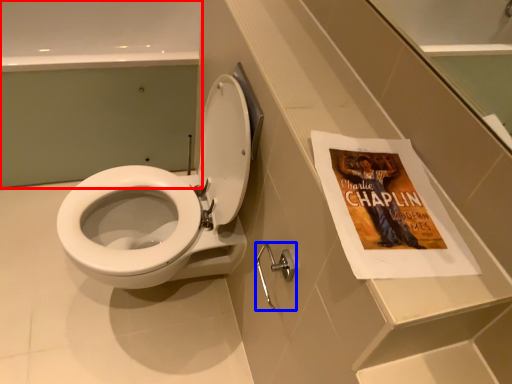
Question: Which object appears closest to the camera in this image, bath (highlighted by a red box) or towel bar (highlighted by a blue box)?

Choices:
 (A) bath
 (B) towel bar

Answer: (B)